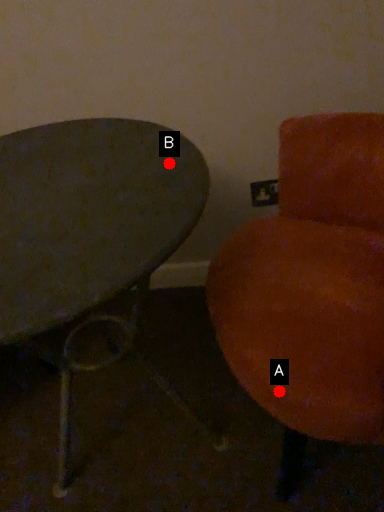
Question: Two points are circled on the image, labeled by A and B beside each circle. Among these points, which one is farthest from the camera?

Choices:
 (A) A is further
 (B) B is further

Answer: (B)